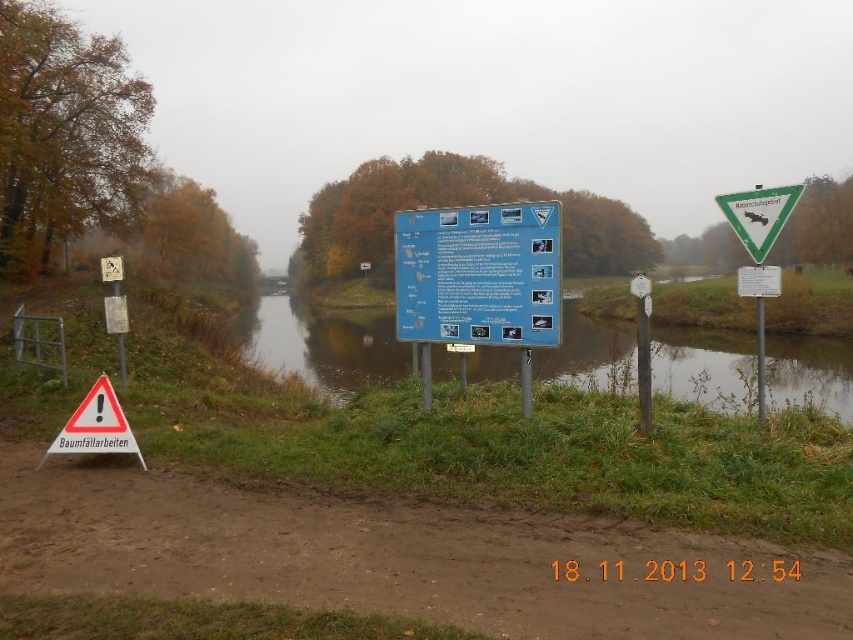
Which is behind, point (260, 340) or point (105, 429)?

Positioned behind is point (260, 340).

Which is more to the left, greenish reflective water at center or red reflective triangle at lower left?

red reflective triangle at lower left

I want to click on greenish reflective water at center, so click(x=323, y=342).

Which of these two, greenish reflective water at center or green plastic sign at upper right, stands shorter?

green plastic sign at upper right

Does greenish reflective water at center appear over green plastic sign at upper right?

No, greenish reflective water at center is not above green plastic sign at upper right.

I want to click on greenish reflective water at center, so click(x=323, y=342).

Does blue plastic sign at center appear on the right side of green plastic sign at upper right?

No, blue plastic sign at center is not to the right of green plastic sign at upper right.

Is point (438, 225) farther from camera compared to point (769, 192)?

Yes, point (438, 225) is behind point (769, 192).

At what (x,y) coordinates should I click in order to perform the action: click on blue plastic sign at center. Please return your answer as a coordinate pair (x, y). The image size is (853, 640). Looking at the image, I should click on (479, 275).